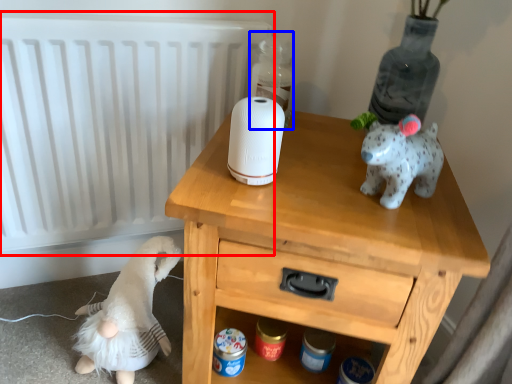
Question: Among these objects, which one is nearest to the camera, radiator (highlighted by a red box) or bottle (highlighted by a blue box)?

Choices:
 (A) radiator
 (B) bottle

Answer: (A)